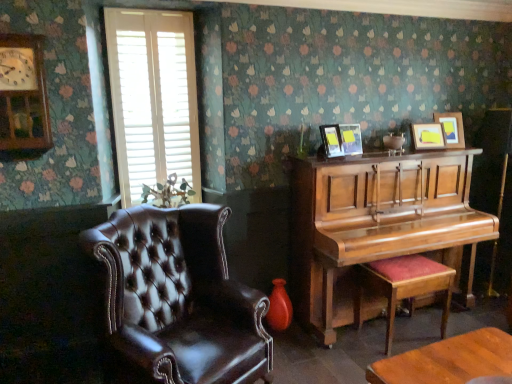
What are the coordinates of `brown leather armchair at left` in the screenshot? It's located at (179, 297).

Describe the element at coordinates (376, 226) in the screenshot. The height and width of the screenshot is (384, 512). I see `shiny brown piano at right` at that location.

Describe the element at coordinates (452, 128) in the screenshot. I see `wooden picture frame at upper right, the 4th picture frame in the left-to-right sequence` at that location.

Identify the location of matte gold picture frame at upper right, arranged as the 2th picture frame when viewed from the left. Image resolution: width=512 pixels, height=384 pixels. (351, 139).

Locate an element on the screen. This screenshot has height=384, width=512. matte wooden picture frame at upper right, which ranks as the second picture frame in right-to-left order is located at coordinates tap(428, 136).

Is wooden picture frame at upper right, marked as the 1th picture frame in a right-to-left arrangement, closer to camera compared to matte black picture frame at upper center, placed as the fourth picture frame when sorted from right to left?

No, the depth of wooden picture frame at upper right, marked as the 1th picture frame in a right-to-left arrangement, is greater than that of matte black picture frame at upper center, placed as the fourth picture frame when sorted from right to left.

How many degrees apart are the facing directions of wooden picture frame at upper right, marked as the 1th picture frame in a right-to-left arrangement, and matte black picture frame at upper center, the first picture frame in the left-to-right sequence?

The facing directions of wooden picture frame at upper right, marked as the 1th picture frame in a right-to-left arrangement, and matte black picture frame at upper center, the first picture frame in the left-to-right sequence, are 29.8 degrees apart.

Which of these two, wooden picture frame at upper right, marked as the 1th picture frame in a right-to-left arrangement, or matte black picture frame at upper center, the first picture frame in the left-to-right sequence, is bigger?

wooden picture frame at upper right, marked as the 1th picture frame in a right-to-left arrangement.

Is wooden picture frame at upper right, the 4th picture frame in the left-to-right sequence, touching matte black picture frame at upper center, placed as the fourth picture frame when sorted from right to left?

wooden picture frame at upper right, the 4th picture frame in the left-to-right sequence, is not next to matte black picture frame at upper center, placed as the fourth picture frame when sorted from right to left, and they're not touching.

From the image's perspective, is wooden picture frame at upper right, the 4th picture frame in the left-to-right sequence, located above or below wooden clock at upper left?

wooden picture frame at upper right, the 4th picture frame in the left-to-right sequence, is below wooden clock at upper left.

From a real-world perspective, is wooden picture frame at upper right, the 4th picture frame in the left-to-right sequence, physically above wooden clock at upper left?

Actually, wooden picture frame at upper right, the 4th picture frame in the left-to-right sequence, is physically below wooden clock at upper left in the real world.

Is there a large distance between wooden picture frame at upper right, the 4th picture frame in the left-to-right sequence, and wooden clock at upper left?

Indeed, wooden picture frame at upper right, the 4th picture frame in the left-to-right sequence, is not near wooden clock at upper left.

Considering the positions of points (448, 114) and (20, 79), is point (448, 114) farther from camera compared to point (20, 79)?

That is True.

Can you confirm if wooden clock at upper left is smaller than matte gold picture frame at upper right, arranged as the 2th picture frame when viewed from the left?

No.

Is wooden clock at upper left taller than matte gold picture frame at upper right, which appears as the 3th picture frame when viewed from the right?

Indeed, wooden clock at upper left has a greater height compared to matte gold picture frame at upper right, which appears as the 3th picture frame when viewed from the right.

Considering the relative positions of wooden clock at upper left and matte gold picture frame at upper right, arranged as the 2th picture frame when viewed from the left, in the image provided, is wooden clock at upper left to the left of matte gold picture frame at upper right, arranged as the 2th picture frame when viewed from the left, from the viewer's perspective?

Correct, you'll find wooden clock at upper left to the left of matte gold picture frame at upper right, arranged as the 2th picture frame when viewed from the left.

Identify the location of the 3rd picture frame below the wooden clock at upper left (from a real-world perspective). The height and width of the screenshot is (384, 512). (351, 139).

Considering the relative positions of shiny brown piano at right and wooden clock at upper left in the image provided, is shiny brown piano at right in front of wooden clock at upper left?

No, shiny brown piano at right is further to the viewer.

Is shiny brown piano at right far from wooden clock at upper left?

Yes, shiny brown piano at right is far from wooden clock at upper left.

Does shiny brown piano at right have a greater height compared to wooden clock at upper left?

Yes, shiny brown piano at right is taller than wooden clock at upper left.

Looking at this image, from the image's perspective, who appears lower, white wood blinds at upper left or matte gold picture frame at upper right, arranged as the 2th picture frame when viewed from the left?

From the image's view, matte gold picture frame at upper right, arranged as the 2th picture frame when viewed from the left, is below.

Which is behind, point (198, 138) or point (342, 145)?

The point (198, 138) is more distant.

Is white wood blinds at upper left aimed at matte gold picture frame at upper right, which appears as the 3th picture frame when viewed from the right?

No.

Is white wood blinds at upper left positioned behind matte gold picture frame at upper right, which appears as the 3th picture frame when viewed from the right?

That is False.

From a real-world perspective, is white wood blinds at upper left on brown leather armchair at left?

Yes, from a real-world perspective, white wood blinds at upper left is on top of brown leather armchair at left.

Which point is more distant from viewer, (x=178, y=145) or (x=265, y=305)?

The point (x=178, y=145) is farther.

In the scene shown: Can you tell me how much white wood blinds at upper left and brown leather armchair at left differ in facing direction?

There is a 28.1-degree angle between the facing directions of white wood blinds at upper left and brown leather armchair at left.

Could you tell me if white wood blinds at upper left is facing brown leather armchair at left?

Yes.

Is matte gold picture frame at upper right, arranged as the 2th picture frame when viewed from the left, positioned far away from white wood blinds at upper left?

Absolutely, matte gold picture frame at upper right, arranged as the 2th picture frame when viewed from the left, is distant from white wood blinds at upper left.

Is matte gold picture frame at upper right, arranged as the 2th picture frame when viewed from the left, in front of or behind white wood blinds at upper left in the image?

In the image, matte gold picture frame at upper right, arranged as the 2th picture frame when viewed from the left, appears behind white wood blinds at upper left.

Starting from the white wood blinds at upper left, which picture frame is the 2nd one behind? Please provide its 2D coordinates.

[(351, 139)]

From a real-world perspective, between matte gold picture frame at upper right, which appears as the 3th picture frame when viewed from the right, and white wood blinds at upper left, who is vertically higher?

white wood blinds at upper left.

The height and width of the screenshot is (384, 512). I want to click on the 3rd picture frame below the wooden picture frame at upper right, marked as the 1th picture frame in a right-to-left arrangement (from the image's perspective), so click(331, 141).

The image size is (512, 384). Identify the location of clock above the wooden picture frame at upper right, marked as the 1th picture frame in a right-to-left arrangement (from the image's perspective). (23, 94).

From the image, which object appears to be farther from brown leather armchair at left, white wood blinds at upper left or matte wooden picture frame at upper right, placed as the third picture frame when sorted from left to right?

matte wooden picture frame at upper right, placed as the third picture frame when sorted from left to right, is further to brown leather armchair at left.

From the image, which object appears to be nearer to white wood blinds at upper left, wooden polished stool at right or wooden clock at upper left?

wooden clock at upper left.

Based on their spatial positions, is matte wooden picture frame at upper right, which ranks as the second picture frame in right-to-left order, or shiny brown piano at right closer to matte black picture frame at upper center, placed as the fourth picture frame when sorted from right to left?

shiny brown piano at right.

Looking at this image, estimate the real-world distances between objects in this image. Which object is further from white wood blinds at upper left, matte black picture frame at upper center, placed as the fourth picture frame when sorted from right to left, or wooden polished stool at right?

wooden polished stool at right is further to white wood blinds at upper left.

In the scene shown: Looking at the image, which one is located further to wooden polished stool at right, matte wooden picture frame at upper right, placed as the third picture frame when sorted from left to right, or shiny brown piano at right?

Based on the image, matte wooden picture frame at upper right, placed as the third picture frame when sorted from left to right, appears to be further to wooden polished stool at right.

Considering their positions, is brown leather armchair at left positioned further to shiny brown piano at right than matte wooden picture frame at upper right, placed as the third picture frame when sorted from left to right?

Among the two, brown leather armchair at left is located further to shiny brown piano at right.

Looking at the image, which one is located further to shiny brown piano at right, matte wooden picture frame at upper right, placed as the third picture frame when sorted from left to right, or matte gold picture frame at upper right, which appears as the 3th picture frame when viewed from the right?

The object further to shiny brown piano at right is matte wooden picture frame at upper right, placed as the third picture frame when sorted from left to right.

Based on the photo, looking at the image, which one is located closer to white wood blinds at upper left, matte gold picture frame at upper right, which appears as the 3th picture frame when viewed from the right, or wooden polished stool at right?

The object closer to white wood blinds at upper left is matte gold picture frame at upper right, which appears as the 3th picture frame when viewed from the right.

Identify the location of piano between brown leather armchair at left and wooden polished stool at right in the horizontal direction. (376, 226).

The height and width of the screenshot is (384, 512). What are the coordinates of `chair between wooden clock at upper left and matte gold picture frame at upper right, which appears as the 3th picture frame when viewed from the right, from left to right` in the screenshot? It's located at (179, 297).

Image resolution: width=512 pixels, height=384 pixels. What are the coordinates of `piano located between wooden clock at upper left and matte wooden picture frame at upper right, placed as the third picture frame when sorted from left to right, in the left-right direction` in the screenshot? It's located at (376, 226).

The height and width of the screenshot is (384, 512). Identify the location of window between wooden clock at upper left and wooden picture frame at upper right, the 4th picture frame in the left-to-right sequence. (153, 99).